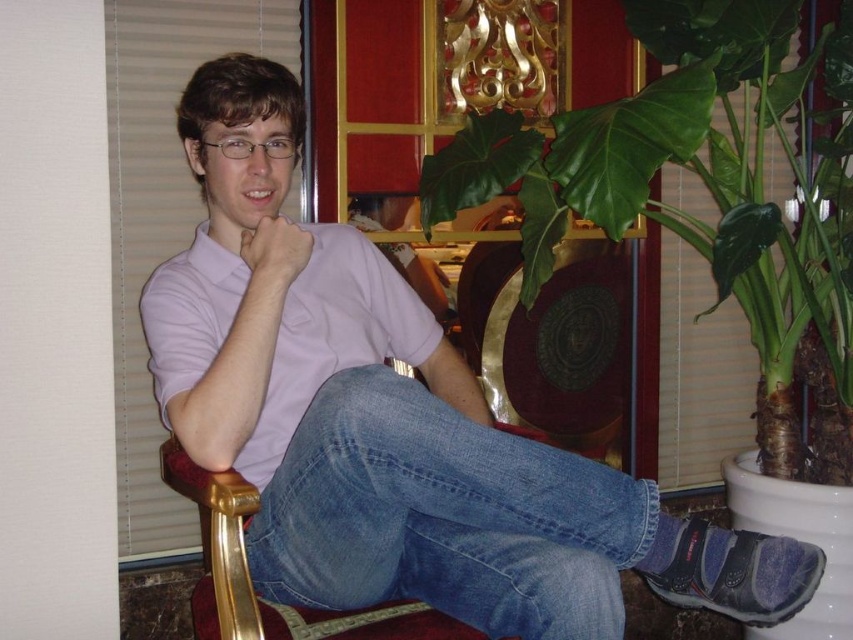
You are a fashion designer observing the person in the image. You need to determine if the light purple shirt at center and the denim jeans at center can be paired together in a new collection. Based on their widths, will the shirt be wider than the jeans?

The light purple shirt at center has a larger width than the denim jeans at center, so yes, the shirt will be wider than the jeans when paired together.

You are a fashion designer observing a model wearing the light purple shirt at center and denim jeans at center. Which clothing item is taller on the model?

The light purple shirt at center is taller than the denim jeans at center.

Looking at this image, you are an interior designer assessing the color coordination in the room. The scene includes a light purple shirt at center and a light purple cotton shirt at center. Which of these two items is positioned lower in the image?

The light purple shirt at center is positioned lower than the light purple cotton shirt at center.